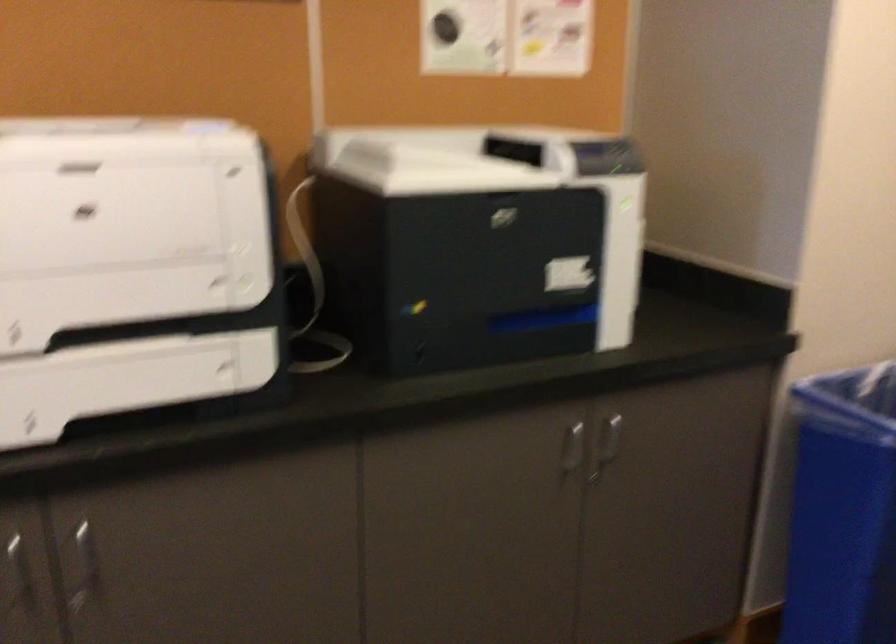
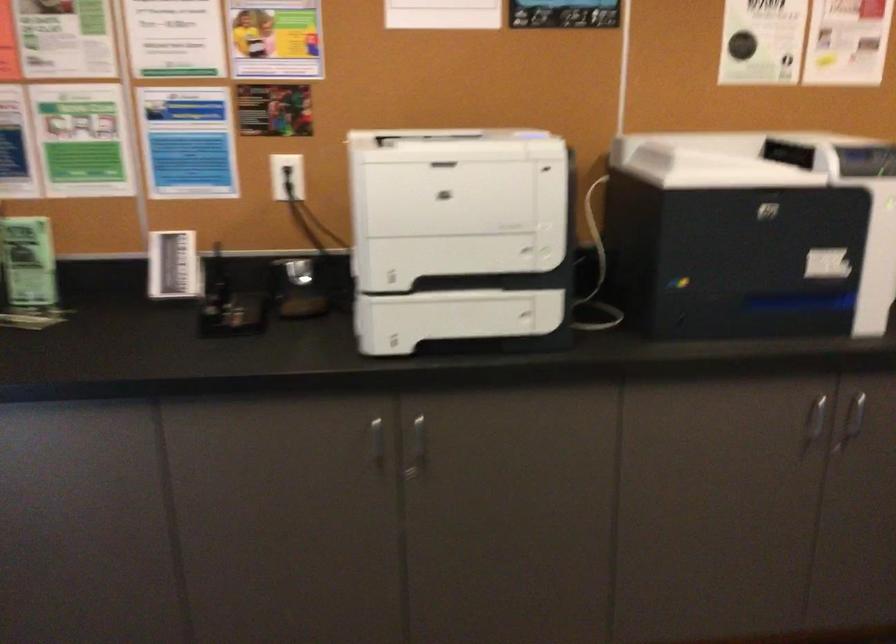
The point at (604, 444) is marked in the first image. Where is the corresponding point in the second image?

(853, 418)